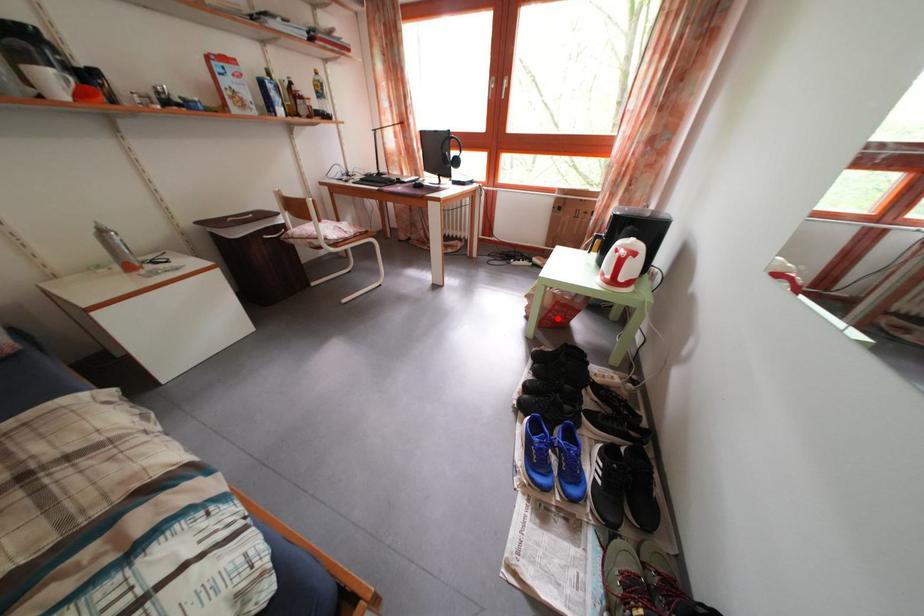
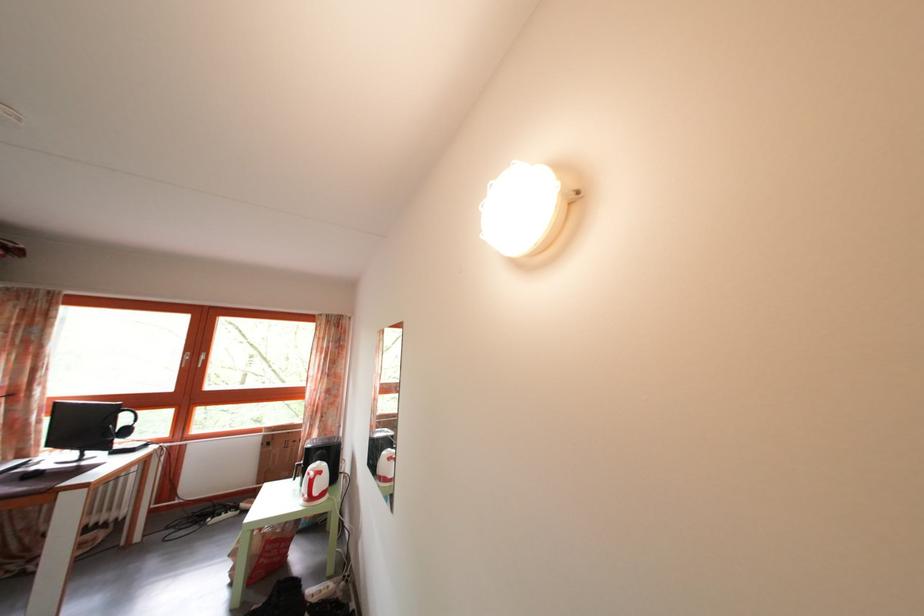
The point at the highlighted location is marked in the first image. Where is the corresponding point in the second image?

(268, 562)